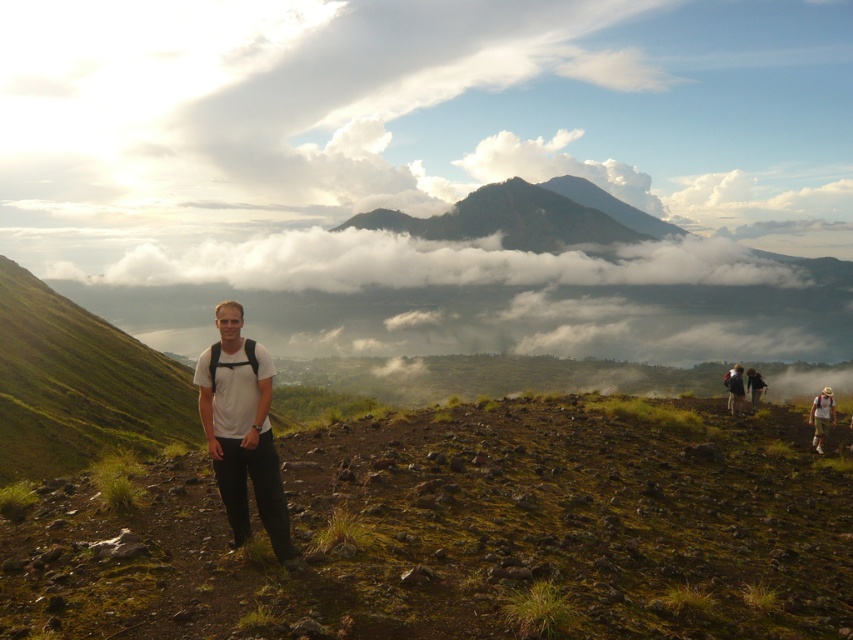
You are a hiker who needs to choose between the camouflage fabric backpack at lower right and the light brown backpack at lower right. Which one has a larger capacity?

The light brown backpack at lower right has a larger capacity since it is bigger in size compared to the camouflage fabric backpack at lower right.